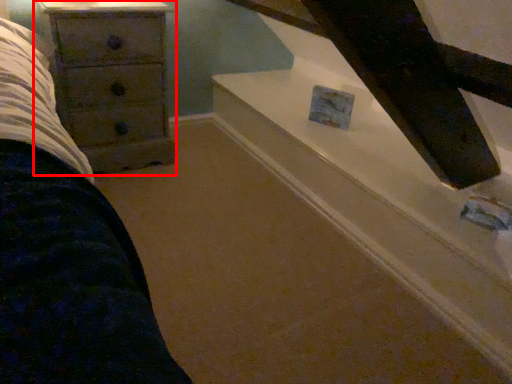
Question: Observing the image, what is the correct spatial positioning of chest of drawers (annotated by the red box) in reference to stairwell?

Choices:
 (A) right
 (B) left

Answer: (B)